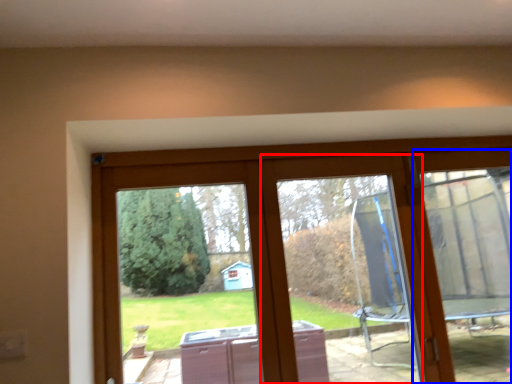
Question: Which object appears closest to the camera in this image, window frame (highlighted by a red box) or screen door (highlighted by a blue box)?

Choices:
 (A) window frame
 (B) screen door

Answer: (A)